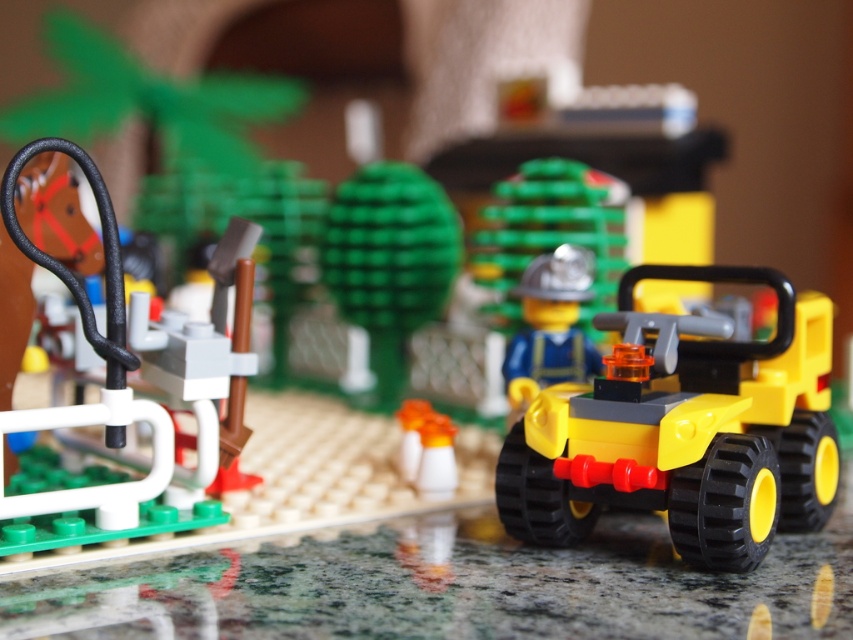
From the picture: Based on the scene description, where is the black rubber hose at left located in terms of coordinates?

The black rubber hose at left is located at point coordinates of [117,388].